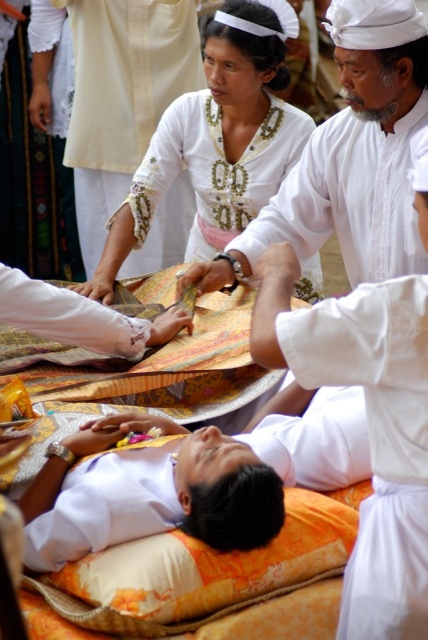
Is white matte cloth at upper center behind white cotton robe at lower right?

Yes, white matte cloth at upper center is behind white cotton robe at lower right.

Who is higher up, white matte cloth at upper center or white cotton robe at lower right?

white matte cloth at upper center is above.

Does point (351, 182) come behind point (368, 308)?

Yes, it is behind point (368, 308).

The image size is (428, 640). Find the location of `white matte cloth at upper center`. white matte cloth at upper center is located at coordinates (357, 150).

Is white cloth at center positioned before white cotton robe at lower right?

That is True.

Can you confirm if white cloth at center is shorter than white cotton robe at lower right?

Yes, white cloth at center is shorter than white cotton robe at lower right.

Identify the location of white cloth at center. (190, 480).

Identify the location of white cloth at center. This screenshot has width=428, height=640. (x=190, y=480).

What do you see at coordinates (190, 480) in the screenshot?
I see `white cloth at center` at bounding box center [190, 480].

Between white cloth at center and white matte cloth at upper center, which one has less height?

white matte cloth at upper center is shorter.

This screenshot has width=428, height=640. In order to click on white cloth at center in this screenshot , I will do `click(190, 480)`.